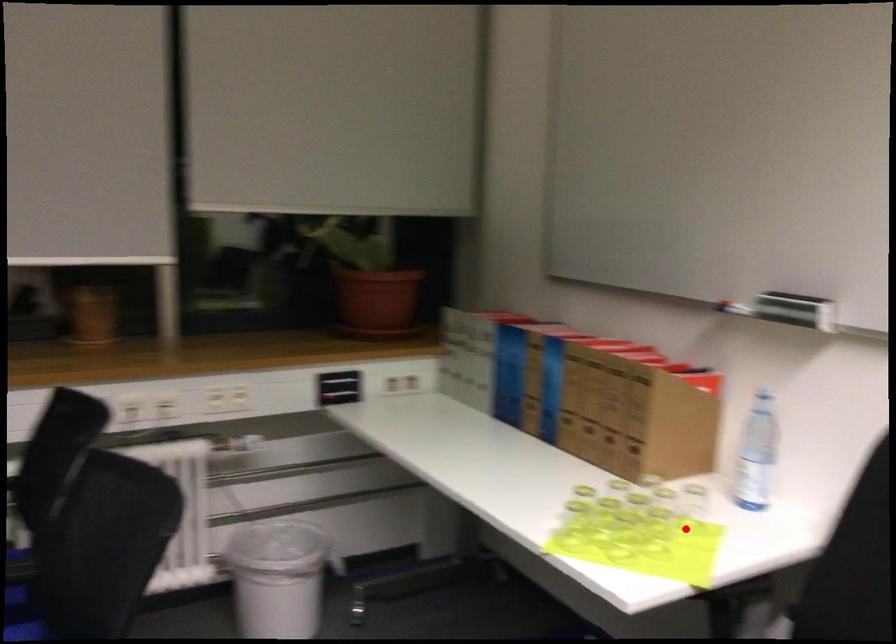
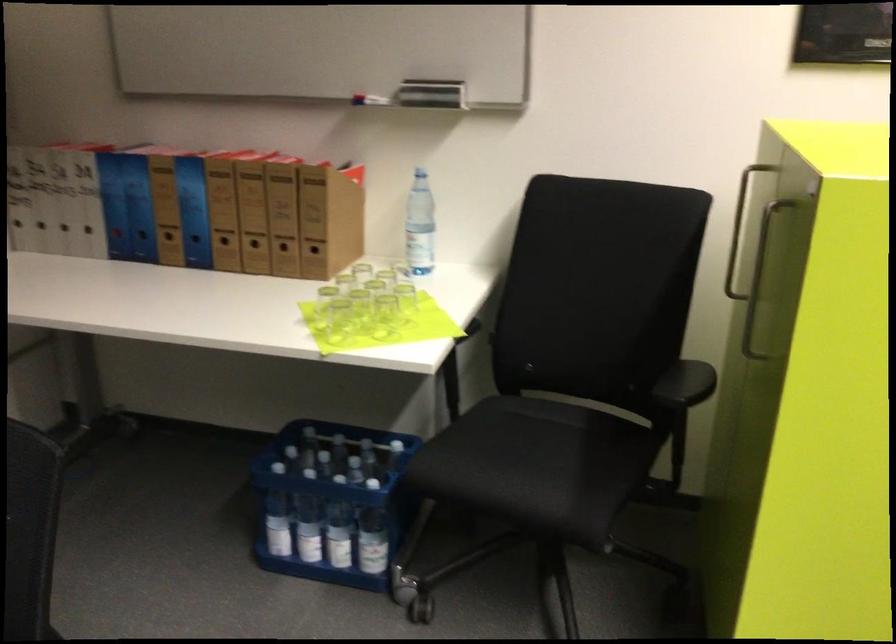
Locate, in the second image, the point that corresponds to the highlighted location in the first image.

(405, 299)